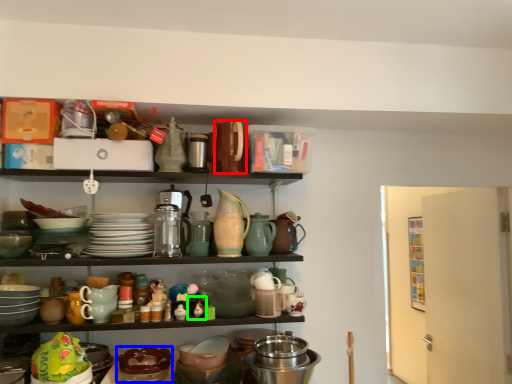
Question: Which object is positioned closest to appliance (highlighted by a red box)? Select from tableware (highlighted by a blue box) and toy (highlighted by a green box).

Choices:
 (A) tableware
 (B) toy

Answer: (B)